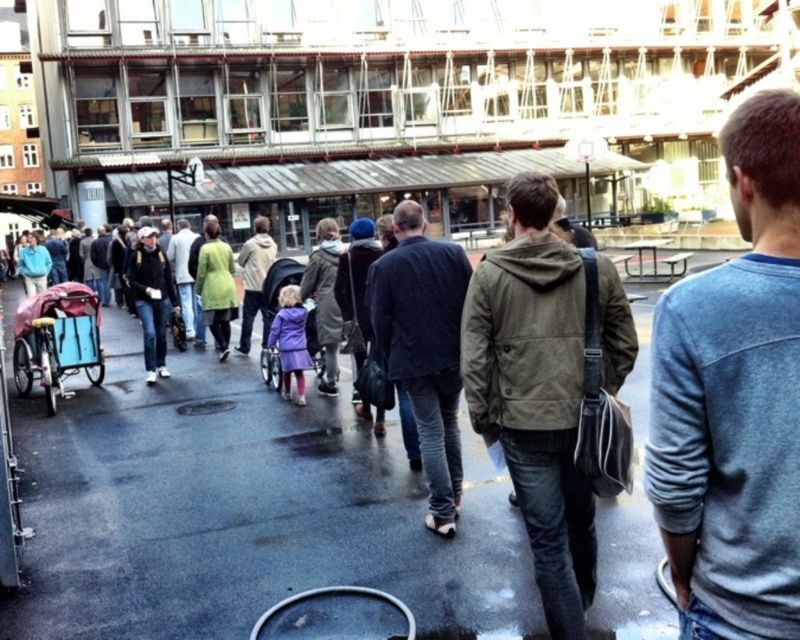
You are a delivery person who needs to place a package on the smooth asphalt pavement at center. However, there is a green fabric coat at center in the way. Can you place the package there without moving the coat?

The smooth asphalt pavement at center is in front of the green fabric coat at center, meaning the coat is closer to you. Therefore, you cannot place the package on the pavement without moving the coat first.

You are a photographer standing in the public square and want to capture both the dark blue corduroy jacket at center and the green fabric coat at center in the same frame. Which one should you focus on first to ensure both are in focus?

The dark blue corduroy jacket at center is positioned under the green fabric coat at center, so focusing on the green fabric coat at center first would ensure both are in focus since it is closer to the camera.